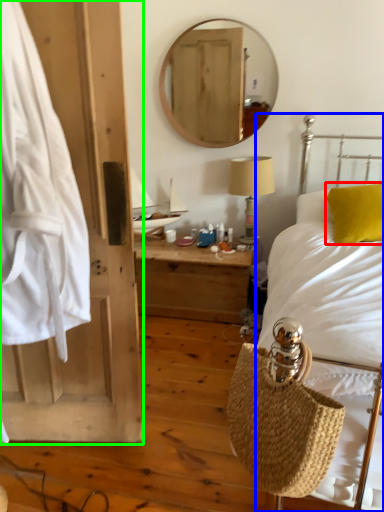
Question: Which object is positioned farthest from pillow (highlighted by a red box)? Select from bed (highlighted by a blue box) and barn door (highlighted by a green box).

Choices:
 (A) bed
 (B) barn door

Answer: (B)